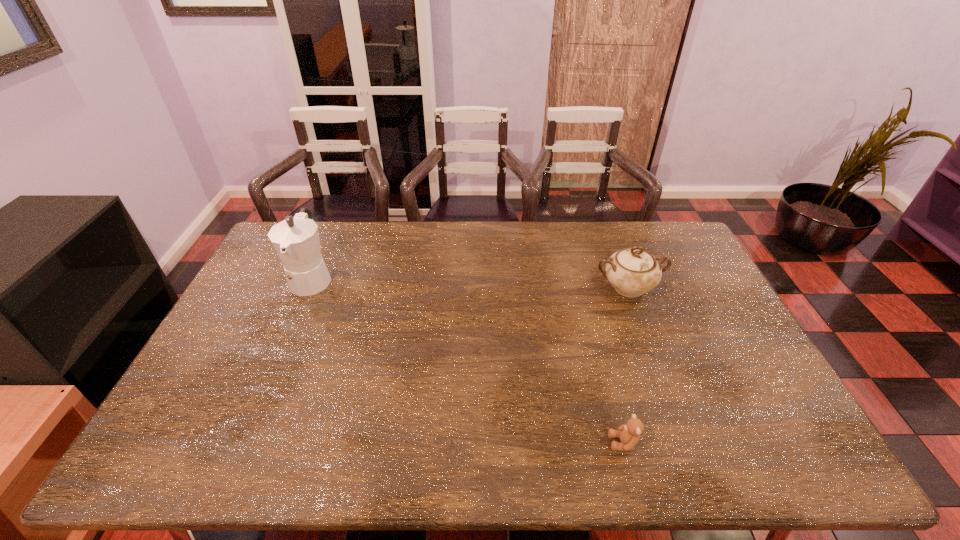
The width and height of the screenshot is (960, 540). Identify the location of vacant region located 0.100m on the face of the shortest object. (567, 443).

Where is `object positioned at the far edge`? This screenshot has height=540, width=960. object positioned at the far edge is located at coordinates (296, 240).

Image resolution: width=960 pixels, height=540 pixels. Find the location of `object located in the near edge section of the desktop`. object located in the near edge section of the desktop is located at coordinates (629, 433).

You are a GUI agent. You are given a task and a screenshot of the screen. Output one action in this format:
    pyautogui.click(x=<x>, y=<y>)
    Task: Click on the object present at the left edge
    The height and width of the screenshot is (540, 960).
    Given the screenshot: What is the action you would take?
    tap(296, 240)

Where is `object that is at the far left corner`? The height and width of the screenshot is (540, 960). object that is at the far left corner is located at coordinates (296, 240).

You are a GUI agent. You are given a task and a screenshot of the screen. Output one action in this format:
    pyautogui.click(x=<x>, y=<y>)
    Task: Click on the vacant area at the far edge
    
    Given the screenshot: What is the action you would take?
    pyautogui.click(x=447, y=249)

In the image, there is a desktop. Identify the location of free region at the near edge. The height and width of the screenshot is (540, 960). (325, 436).

In the image, there is a desktop. At what (x,y) coordinates should I click in order to perform the action: click on free space at the right edge. Please return your answer as a coordinate pair (x, y). This screenshot has width=960, height=540. Looking at the image, I should click on (722, 403).

Find the location of `vacant space at the far left corner of the desktop`. vacant space at the far left corner of the desktop is located at coordinates (272, 251).

Where is `free space at the near left corner of the desktop`? The height and width of the screenshot is (540, 960). free space at the near left corner of the desktop is located at coordinates (180, 443).